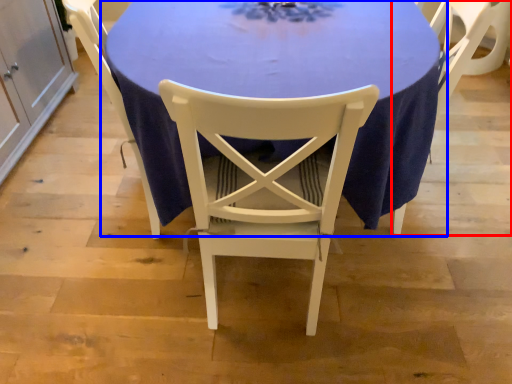
Question: Which object is further to the camera taking this photo, chair (highlighted by a red box) or table (highlighted by a blue box)?

Choices:
 (A) chair
 (B) table

Answer: (A)